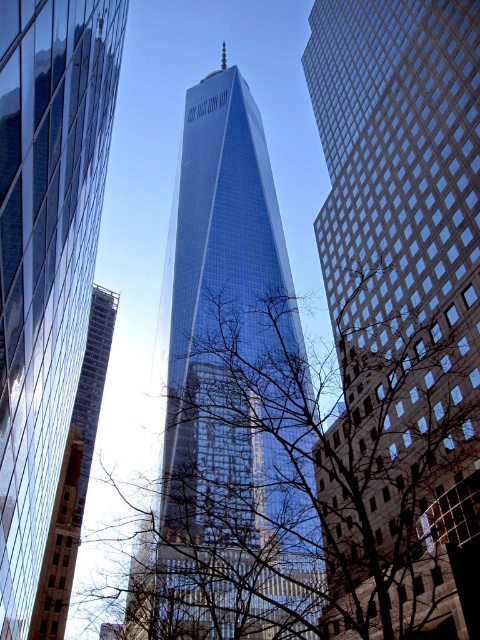
Who is positioned more to the right, bare branches at center or glassy blue skyscraper at center?

From the viewer's perspective, bare branches at center appears more on the right side.

Between bare branches at center and glassy blue skyscraper at center, which one has more height?

Standing taller between the two is bare branches at center.

Which is behind, point (371, 298) or point (2, 394)?

Point (371, 298)

Where is `bare branches at center`? bare branches at center is located at coordinates (327, 481).

The width and height of the screenshot is (480, 640). Describe the element at coordinates (399, 292) in the screenshot. I see `glassy steel skyscraper at center` at that location.

At what (x,y) coordinates should I click in order to perform the action: click on glassy steel skyscraper at center. Please return your answer as a coordinate pair (x, y). The width and height of the screenshot is (480, 640). Looking at the image, I should click on (399, 292).

Between glassy steel skyscraper at center and glassy blue skyscraper at center, which one is positioned lower?

glassy blue skyscraper at center is below.

Is glassy steel skyscraper at center to the left of glassy blue skyscraper at center from the viewer's perspective?

Incorrect, glassy steel skyscraper at center is not on the left side of glassy blue skyscraper at center.

Does point (361, 228) come farther from viewer compared to point (25, 221)?

That is True.

Where is `glassy steel skyscraper at center`? glassy steel skyscraper at center is located at coordinates (399, 292).